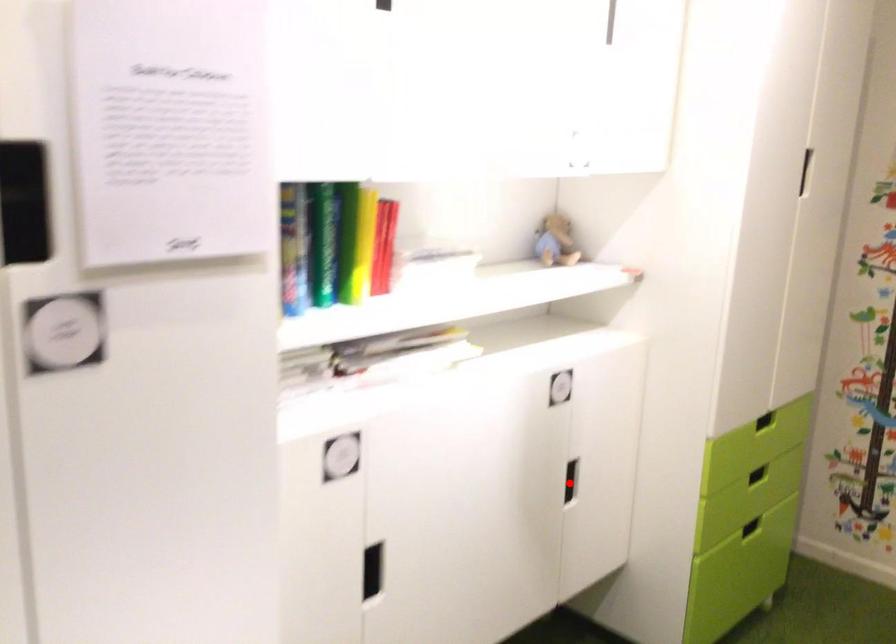
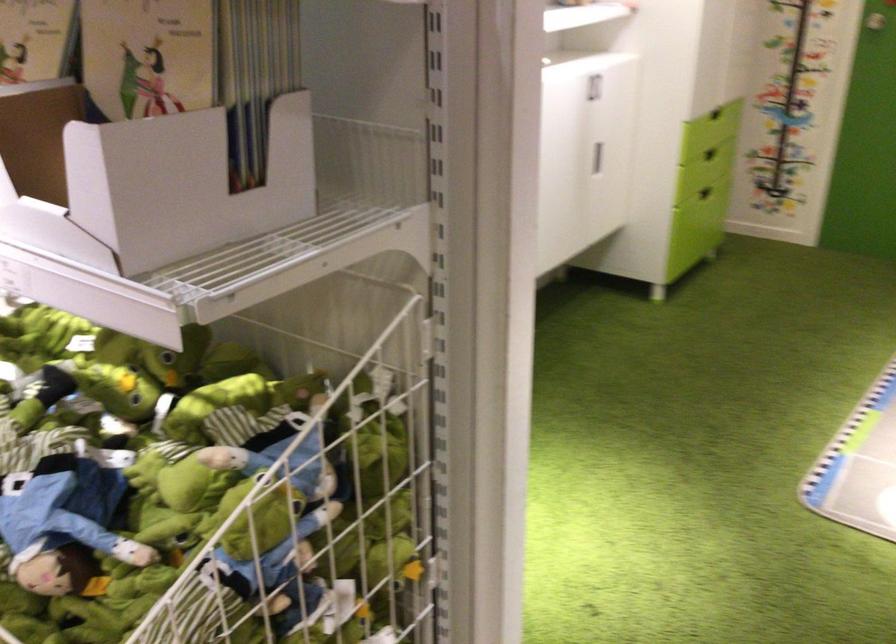
Question: I am providing you with two images of the same scene from different viewpoints. Given a red point in image1, look at the same physical point in image2. Is it:

Choices:
 (A) Closer to the viewpoint
 (B) Farther from the viewpoint

Answer: (B)